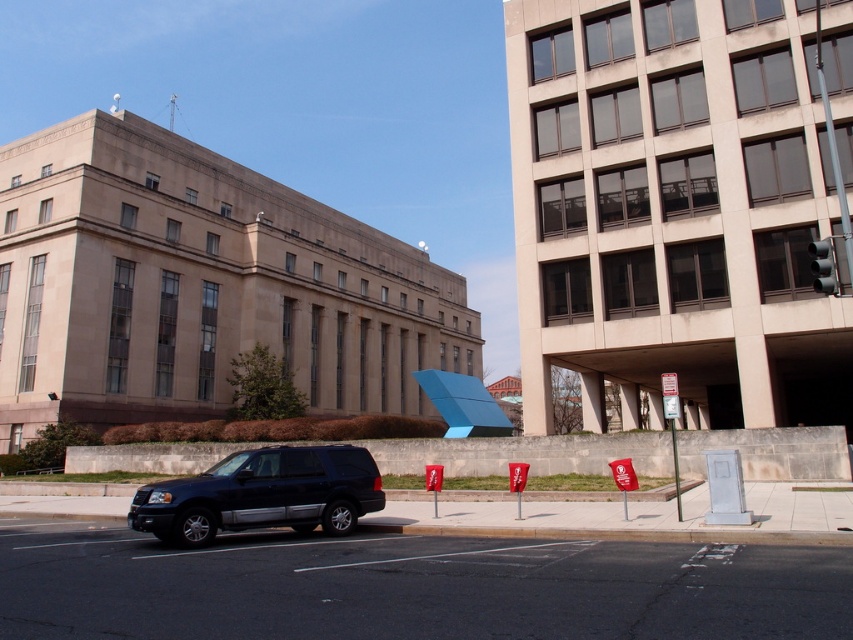
You are a driver looking for parking. You see a shiny black suv at center and a metallic silver parking sign at right. Which object is taller?

The metallic silver parking sign at right is taller than the shiny black suv at center.

You are standing at the camera position and want to take a photo of the shiny black suv at center. Given that your camera has a maximum zoom range of 10 meters, can you capture the entire suv in the photo without moving closer?

The shiny black suv at center and camera are 13.11 meters apart, which exceeds the camera maximum zoom range of 10 meters. Therefore, you cannot capture the entire suv in the photo without moving closer.

You are standing at the point labeled as point (262, 493) in the image. What object are you currently standing on?

You are standing on the shiny black suv at center.